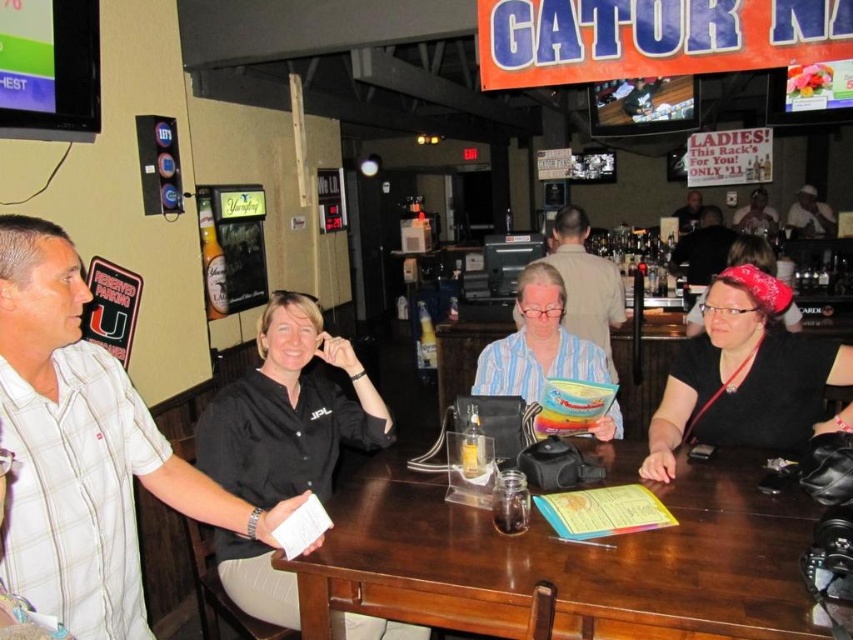
Question: Can you confirm if black shirt at center is positioned to the right of striped cotton shirt at center?

Choices:
 (A) no
 (B) yes

Answer: (A)

Question: Which object is farther from the camera taking this photo?

Choices:
 (A) translucent plastic bottle at table center
 (B) black shirt at center
 (C) brown wood table at center
 (D) striped cotton shirt at center

Answer: (D)

Question: Does brown wood table at center have a larger size compared to striped cotton shirt at center?

Choices:
 (A) yes
 (B) no

Answer: (A)

Question: Can you confirm if black shirt at center is positioned above translucent plastic bottle at table center?

Choices:
 (A) yes
 (B) no

Answer: (B)

Question: Among these points, which one is nearest to the camera?

Choices:
 (A) (688, 406)
 (B) (527, 266)

Answer: (A)

Question: Which point is farther from the camera taking this photo?

Choices:
 (A) (305, 586)
 (B) (715, 356)

Answer: (B)